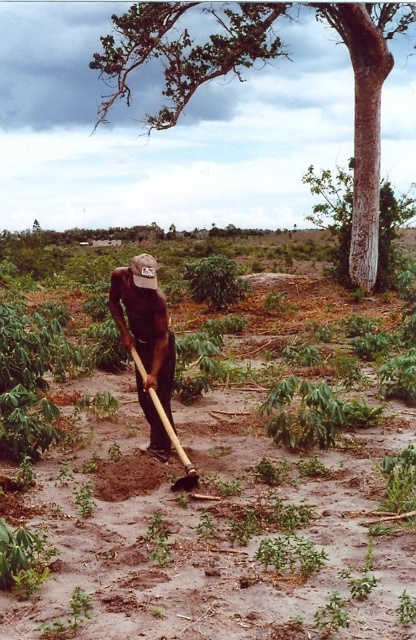
You are a farmer in the cassava field. You notice the smooth bark tree at upper center and the dark skin wood hoe at center. Which object is higher up in the scene?

The smooth bark tree at upper center is positioned over the dark skin wood hoe at center, so the smooth bark tree at upper center is higher up in the scene.

You are a farmer standing at the point marked by the coordinate point (264, 61). You want to walk towards the smooth bark tree at upper center. Which direction should you face to walk straight towards it?

The point (264, 61) is already at the smooth bark tree at upper center, so you are already at the tree. No need to move.